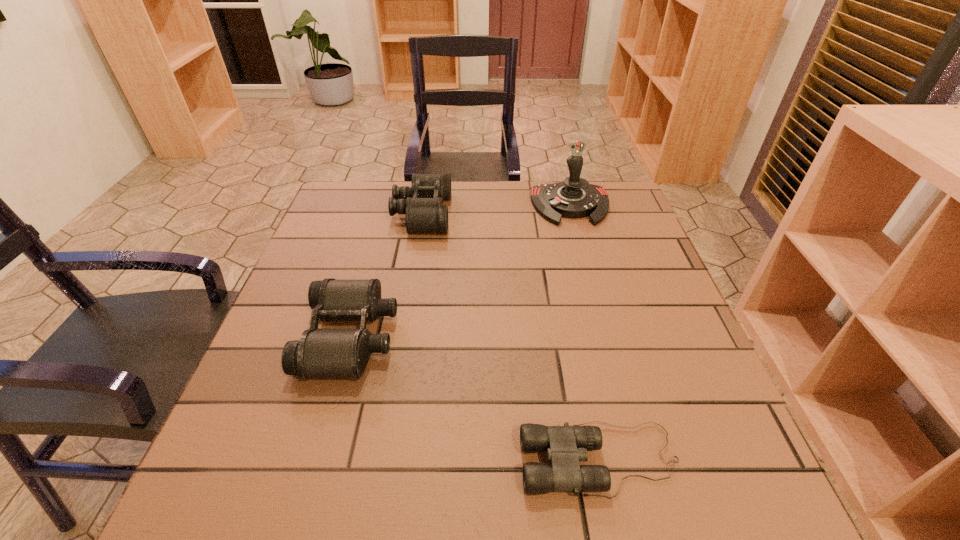
I want to click on free space that satisfies the following two spatial constraints: 1. on the handle side of the tallest object; 2. through the eyepieces of the second nearest object, so (x=607, y=336).

The height and width of the screenshot is (540, 960). I want to click on free spot that satisfies the following two spatial constraints: 1. on the handle side of the joystick; 2. at the eyepiece of the nearest binoculars, so click(x=641, y=460).

Locate an element on the screen. The image size is (960, 540). free space that satisfies the following two spatial constraints: 1. on the handle side of the joystick; 2. at the eyepiece of the shortest object is located at coordinates (641, 460).

In order to click on blank space that satisfies the following two spatial constraints: 1. on the handle side of the joystick; 2. at the eyepieces of the farthest binoculars in this screenshot , I will do `click(573, 214)`.

The image size is (960, 540). Identify the location of free location that satisfies the following two spatial constraints: 1. on the handle side of the tallest object; 2. at the eyepiece of the shortest object. (641, 460).

Image resolution: width=960 pixels, height=540 pixels. What are the coordinates of `free point that satisfies the following two spatial constraints: 1. on the handle side of the tallest object; 2. at the eyepiece of the nearest object` in the screenshot? It's located at (641, 460).